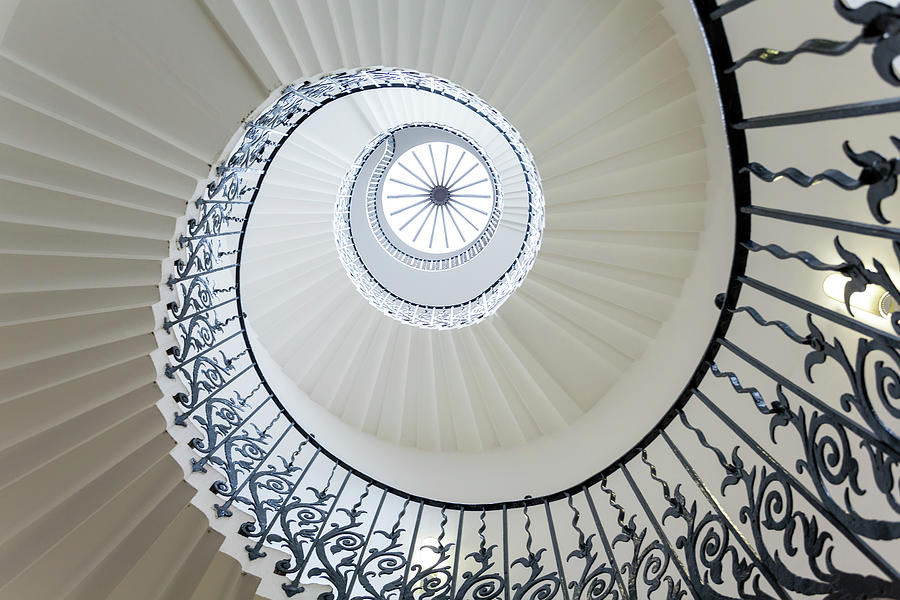
Identify the location of light fixture. This screenshot has width=900, height=600. (424, 171), (471, 197), (415, 227).